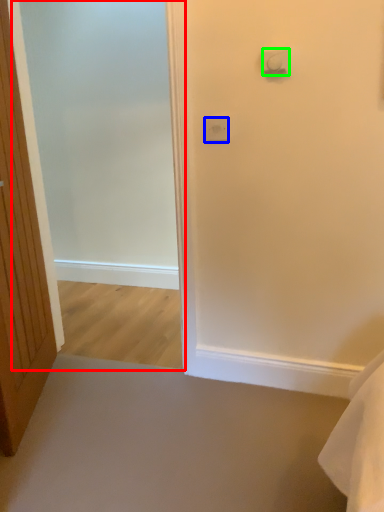
Question: Which object is positioned closest to screen door (highlighted by a red box)? Select from light switch (highlighted by a blue box) and light switch (highlighted by a green box).

Choices:
 (A) light switch
 (B) light switch

Answer: (A)